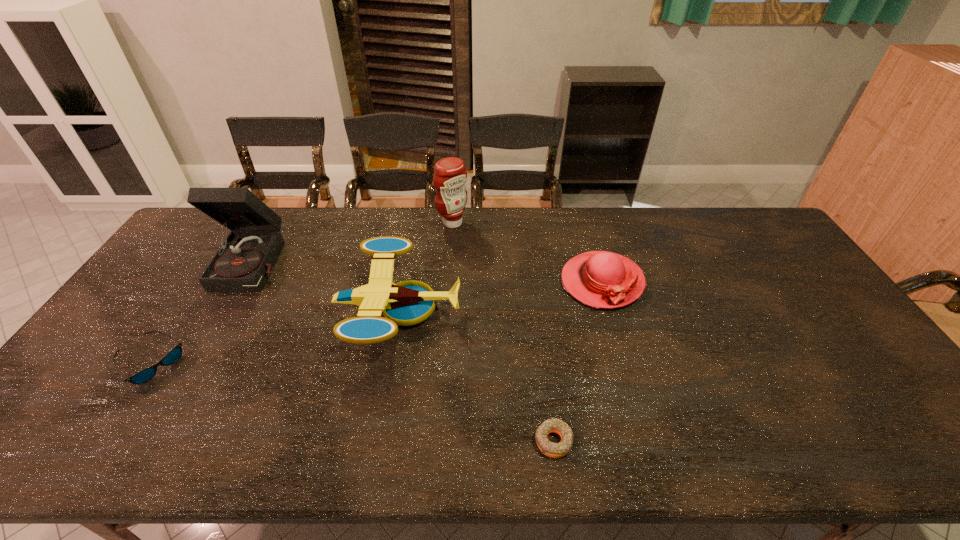
Identify the location of vacant region at the left edge of the desktop. The image size is (960, 540). (113, 349).

The image size is (960, 540). In the image, there is a desktop. Identify the location of free space at the far right corner. coord(759,238).

Locate an element on the screen. The image size is (960, 540). free space between the sunglasses and the drone is located at coordinates (275, 337).

Where is `vacant space in between the third shortest object and the drone`? vacant space in between the third shortest object and the drone is located at coordinates (500, 296).

Where is `free space between the phonograph_record and the sunglasses`? free space between the phonograph_record and the sunglasses is located at coordinates (203, 313).

At what (x,y) coordinates should I click in order to perform the action: click on free space between the condiment and the drone. Please return your answer as a coordinate pair (x, y). Looking at the image, I should click on (425, 267).

Locate an element on the screen. This screenshot has height=540, width=960. empty space between the hat and the condiment is located at coordinates (527, 252).

Where is `free space between the hat and the nearest object`? The height and width of the screenshot is (540, 960). free space between the hat and the nearest object is located at coordinates (578, 361).

Identify the location of free spot between the rightmost object and the phonograph_record. This screenshot has height=540, width=960. (429, 272).

Identify the location of vacant region between the phonograph_record and the rightmost object. This screenshot has width=960, height=540. pos(429,272).